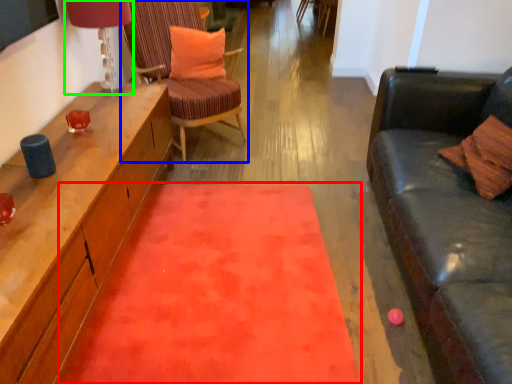
Question: Which object is positioned farthest from mat (highlighted by a red box)? Select from chair (highlighted by a blue box) and lamp (highlighted by a green box).

Choices:
 (A) chair
 (B) lamp

Answer: (B)